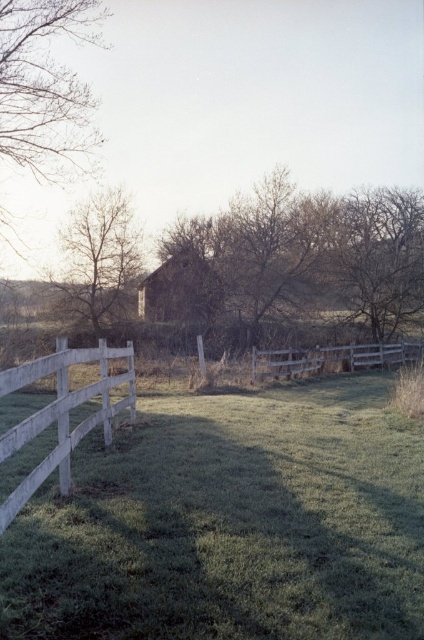
You are an artist setting up an easel to paint the scene. You want to ensure that the bare wood tree at left and the wooden fence at center are proportionally accurate in your painting. Which object should you paint smaller to maintain the correct scale?

The bare wood tree at left should be painted smaller than the wooden fence at center because the description states that the bare wood tree at left has a smaller size compared to wooden fence at center.

You are standing in the rural scene and want to walk from the point at coordinates (343, 298) to the point at coordinates (89, 304). Which direction should you head to get closer to your destination?

You should head downward because point (343, 298) is further to the viewer than point (89, 304), so moving downward will take you towards the destination.